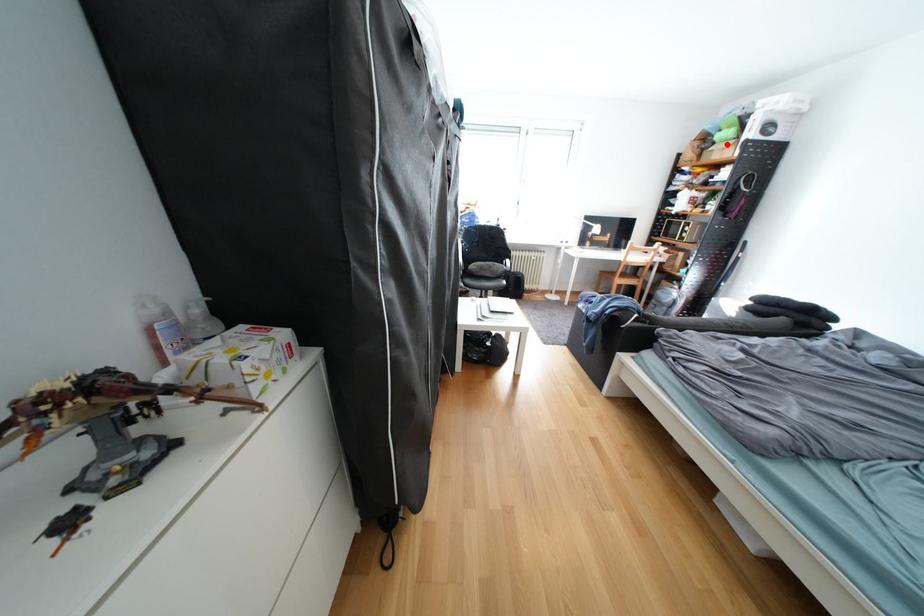
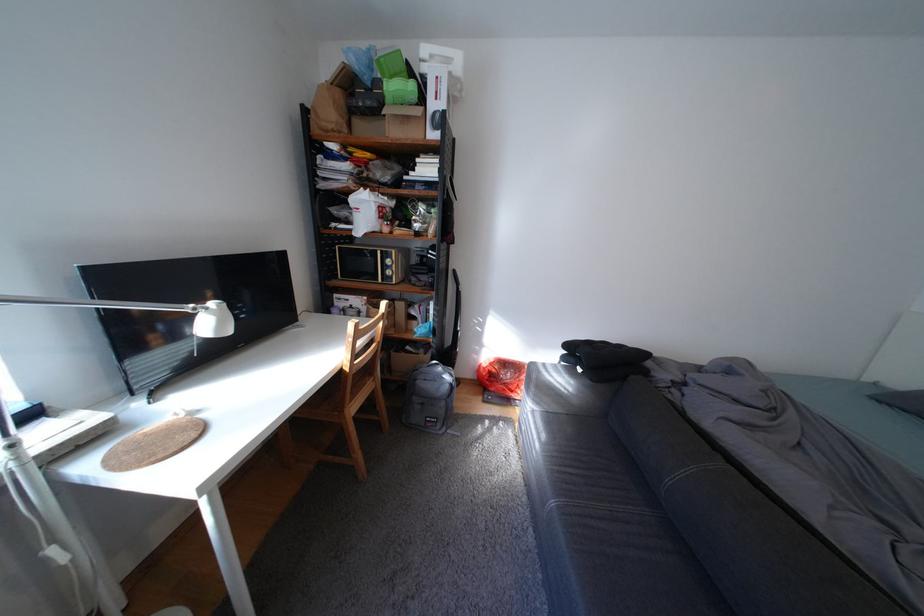
In the second image, find the point that corresponds to the highlighted location in the first image.

(395, 103)